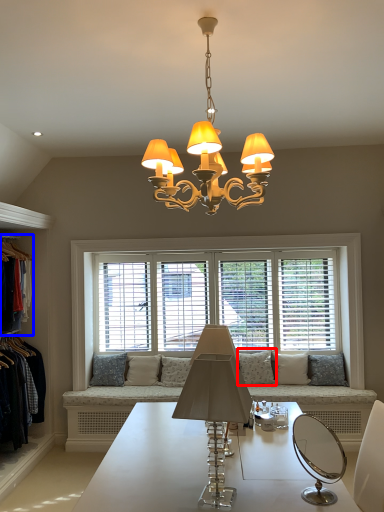
Question: Which point is closer to the camera, pillow (highlighted by a red box) or clothing (highlighted by a blue box)?

Choices:
 (A) pillow
 (B) clothing

Answer: (B)